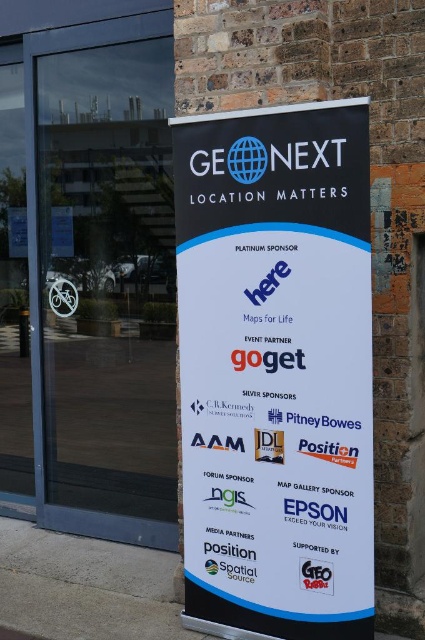
Question: Which of these objects is positioned farthest from the matte red logo at center?

Choices:
 (A) blue glossy globe at upper center
 (B) white plastic bicycle at left

Answer: (B)

Question: Does white paper sign at center appear over blue glossy globe at upper center?

Choices:
 (A) yes
 (B) no

Answer: (B)

Question: Which point appears closest to the camera in this image?

Choices:
 (A) (31, 621)
 (B) (316, 584)
 (C) (57, 310)

Answer: (B)

Question: Does white paper sign at center have a smaller size compared to blue glossy globe at upper center?

Choices:
 (A) no
 (B) yes

Answer: (A)

Question: Based on their relative distances, which object is nearer to the white plastic bicycle at left?

Choices:
 (A) blue glossy globe at upper center
 (B) gray concrete pavement at lower center

Answer: (B)

Question: Is blue glossy globe at upper center closer to camera compared to matte red logo at center?

Choices:
 (A) yes
 (B) no

Answer: (B)